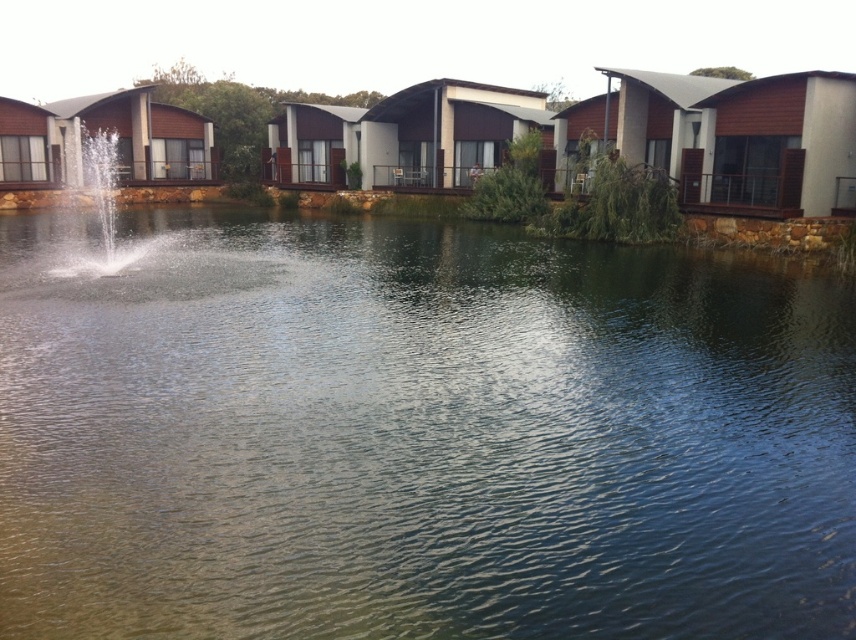
Question: Does clear water at center appear under clear water fountain at center?

Choices:
 (A) no
 (B) yes

Answer: (B)

Question: Is clear water at center wider than clear water fountain at center?

Choices:
 (A) yes
 (B) no

Answer: (A)

Question: Which object appears closest to the camera in this image?

Choices:
 (A) clear water fountain at center
 (B) clear water at center

Answer: (B)

Question: Which of the following is the farthest from the observer?

Choices:
 (A) clear water fountain at center
 (B) clear water at center

Answer: (A)

Question: Is clear water at center bigger than clear water fountain at center?

Choices:
 (A) no
 (B) yes

Answer: (A)